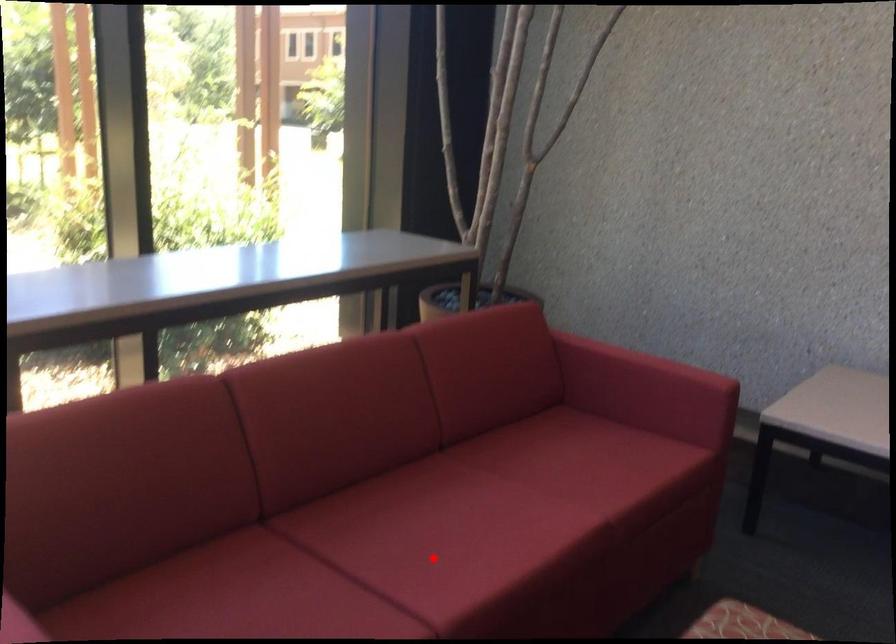
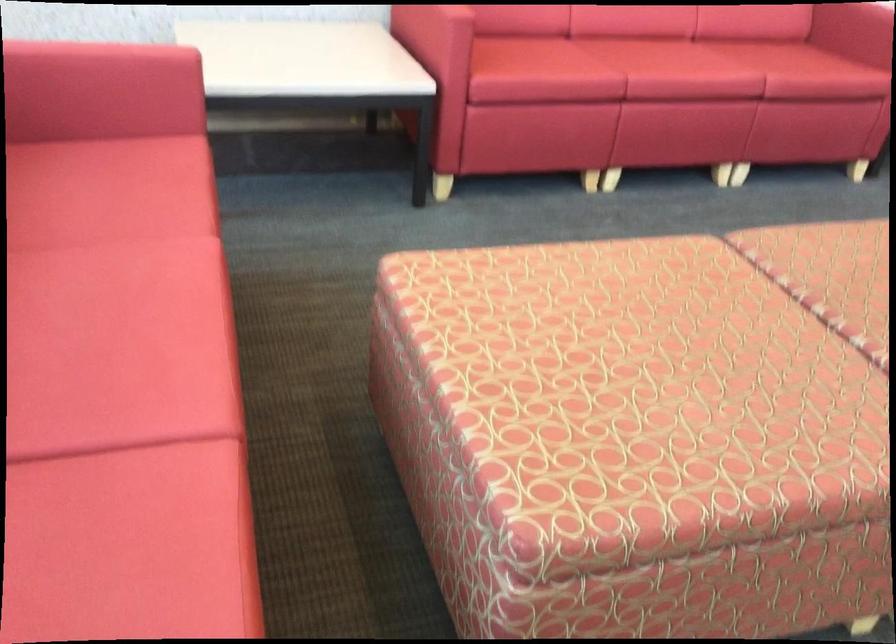
Question: I am providing you with two images of the same scene from different viewpoints. Image1 has a red point marked. In image2, the corresponding 3D location appears at what relative position? Reply with the corresponding letter.

Choices:
 (A) Closer
 (B) Farther

Answer: (A)